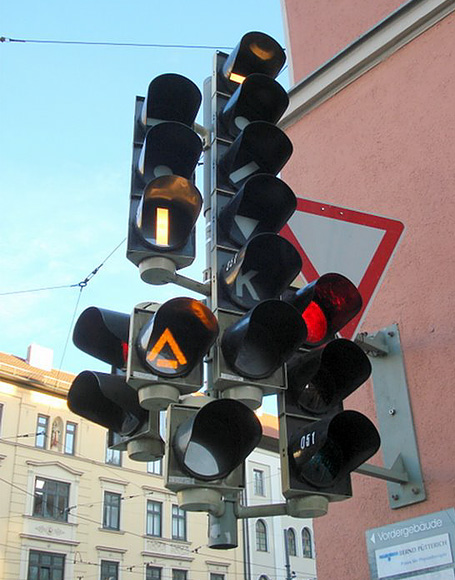
At what (x,y) coordinates should I click in order to perform the action: click on screws. Please return your answer as a coordinate pair (x, y). Looking at the image, I should click on (392, 495), (413, 491), (385, 408), (390, 336).